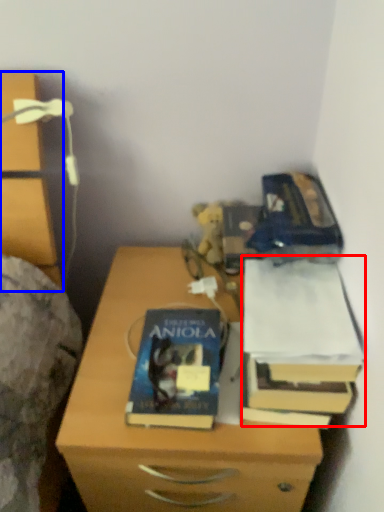
Question: Among these objects, which one is nearest to the camera, paperback book (highlighted by a red box) or chest of drawers (highlighted by a blue box)?

Choices:
 (A) paperback book
 (B) chest of drawers

Answer: (B)